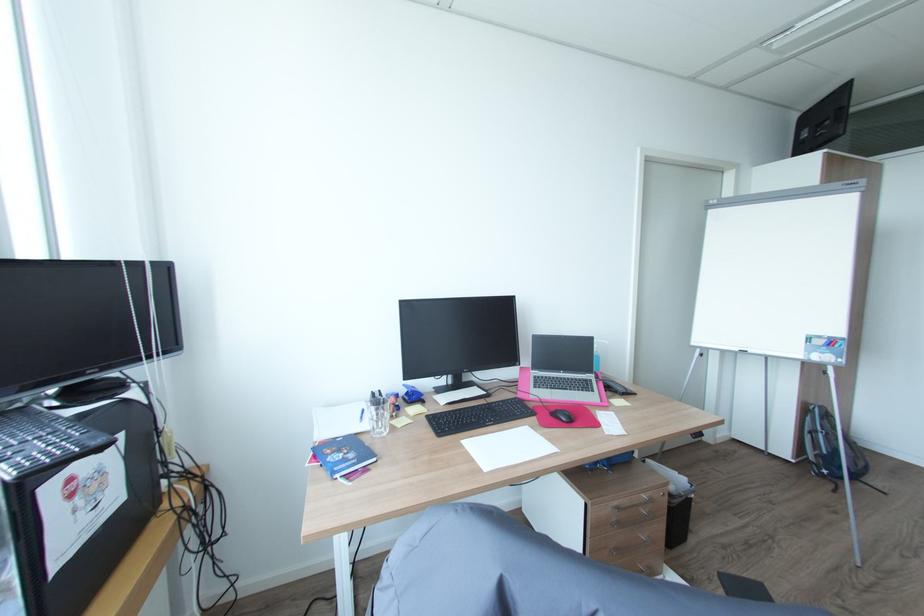
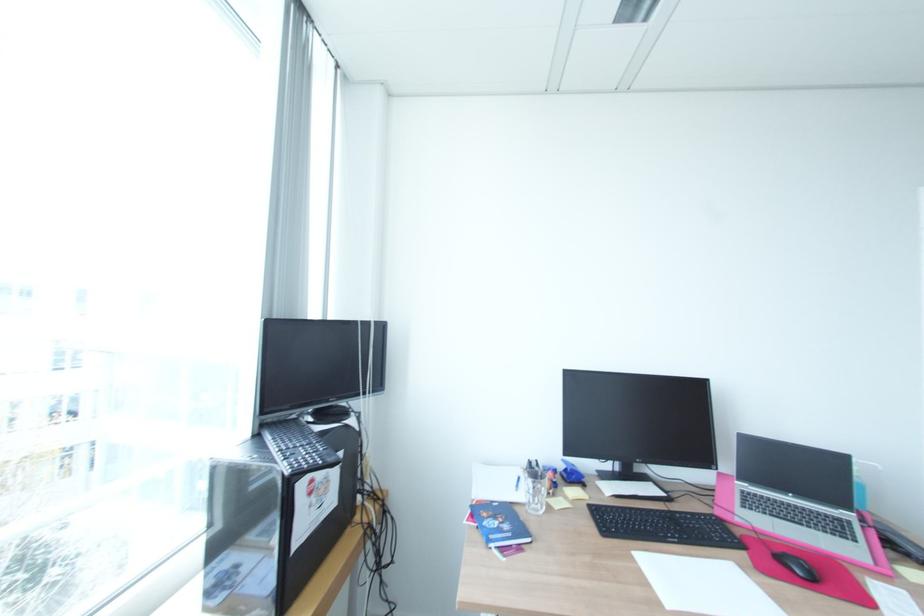
The images are taken continuously from a first-person perspective. In which direction are you moving?

The cameraman moved toward left, backward.